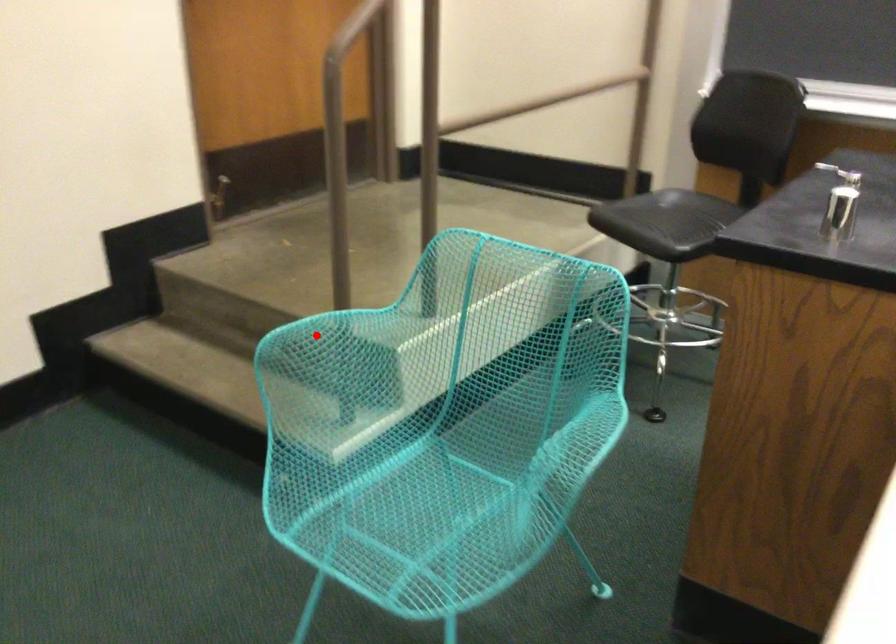
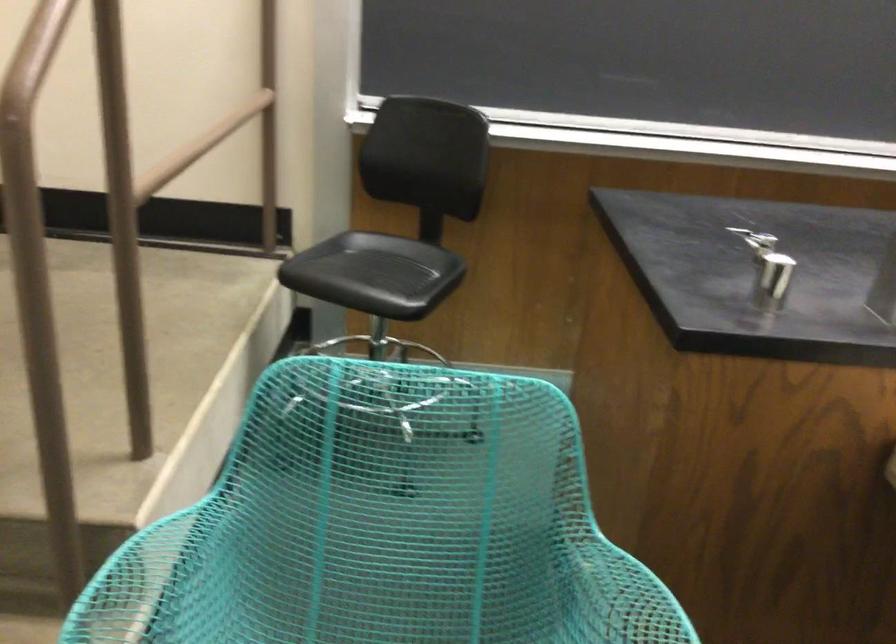
The point at the highlighted location is marked in the first image. Where is the corresponding point in the second image?

(150, 582)